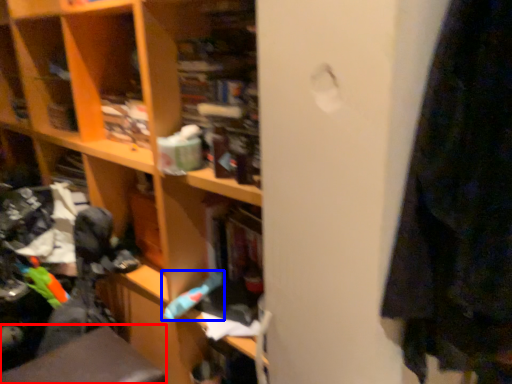
Question: Which object appears farthest to the camera in this image, swivel chair (highlighted by a red box) or toy (highlighted by a blue box)?

Choices:
 (A) swivel chair
 (B) toy

Answer: (B)